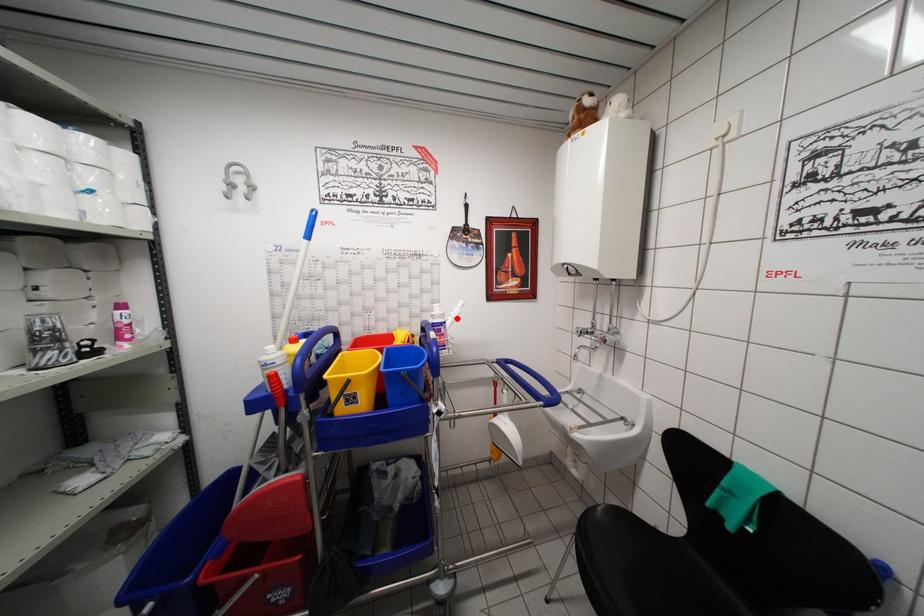
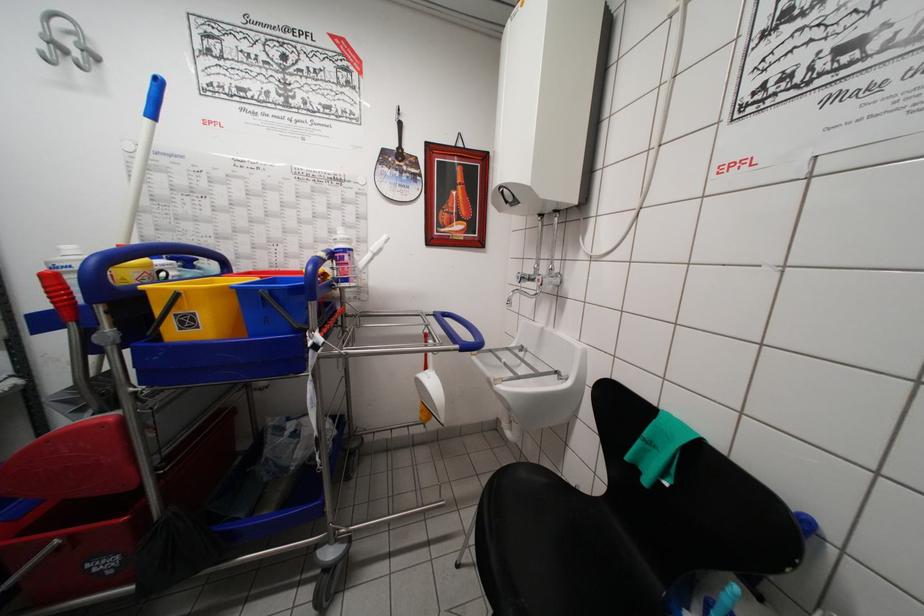
The point at the highlighted location is marked in the first image. Where is the corresponding point in the second image?

(377, 253)